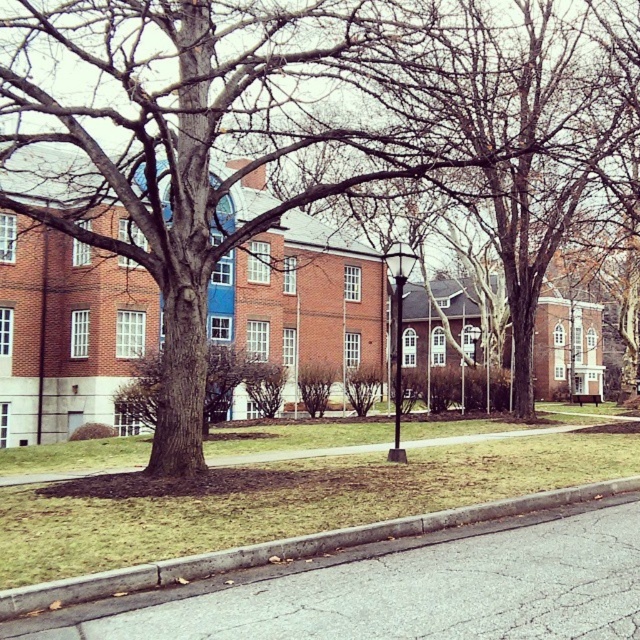
Which is below, brown rough bark tree at center or metallic pole at center?

Positioned lower is metallic pole at center.

Between point (298, 115) and point (392, 449), which one is positioned behind?

Point (298, 115)

Locate an element on the screen. Image resolution: width=640 pixels, height=640 pixels. brown rough bark tree at center is located at coordinates (214, 132).

Is gray concrete curb at lower center thinner than metallic pole at center?

No.

Identify the location of gray concrete curb at lower center. This screenshot has height=640, width=640. (291, 548).

This screenshot has width=640, height=640. Describe the element at coordinates (291, 548) in the screenshot. I see `gray concrete curb at lower center` at that location.

Identify the location of gray concrete curb at lower center. (291, 548).

Between point (289, 115) and point (177, 557), which one is positioned behind?

Point (289, 115)

Is brown rough bark tree at center smaller than gray concrete curb at lower center?

Incorrect, brown rough bark tree at center is not smaller in size than gray concrete curb at lower center.

The width and height of the screenshot is (640, 640). What do you see at coordinates (214, 132) in the screenshot? I see `brown rough bark tree at center` at bounding box center [214, 132].

This screenshot has width=640, height=640. What are the coordinates of `brown rough bark tree at center` in the screenshot? It's located at (214, 132).